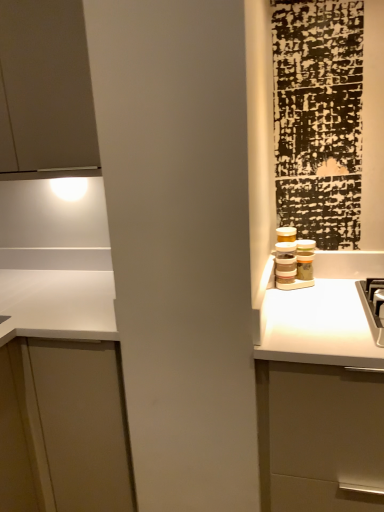
Question: Does point (3, 15) appear closer or farther from the camera than point (66, 384)?

Choices:
 (A) closer
 (B) farther

Answer: (B)

Question: Considering the positions of matte white cabinet at upper left, the first cabinetry positioned from the top, and white matte cabinet at left, marked as the second cabinetry in a top-to-bottom arrangement, in the image, is matte white cabinet at upper left, the first cabinetry positioned from the top, taller or shorter than white matte cabinet at left, marked as the second cabinetry in a top-to-bottom arrangement,?

Choices:
 (A) tall
 (B) short

Answer: (B)

Question: In terms of width, does matte white cabinet at upper left, the 2th cabinetry positioned from the bottom, look wider or thinner when compared to white matte cabinet at left, marked as the second cabinetry in a top-to-bottom arrangement?

Choices:
 (A) thin
 (B) wide

Answer: (A)

Question: Considering the positions of white matte cabinet at left, marked as the second cabinetry in a top-to-bottom arrangement, and matte white cabinet at upper left, the 2th cabinetry positioned from the bottom, in the image, is white matte cabinet at left, marked as the second cabinetry in a top-to-bottom arrangement, wider or thinner than matte white cabinet at upper left, the 2th cabinetry positioned from the bottom,?

Choices:
 (A) wide
 (B) thin

Answer: (A)

Question: Is point (112, 314) positioned closer to the camera than point (56, 111)?

Choices:
 (A) closer
 (B) farther

Answer: (A)

Question: Is white matte cabinet at left, marked as the second cabinetry in a top-to-bottom arrangement, situated inside matte white cabinet at upper left, the 2th cabinetry positioned from the bottom, or outside?

Choices:
 (A) inside
 (B) outside

Answer: (B)

Question: From the image's perspective, is white matte cabinet at left, marked as the second cabinetry in a top-to-bottom arrangement, located above or below matte white cabinet at upper left, the 2th cabinetry positioned from the bottom?

Choices:
 (A) below
 (B) above

Answer: (A)